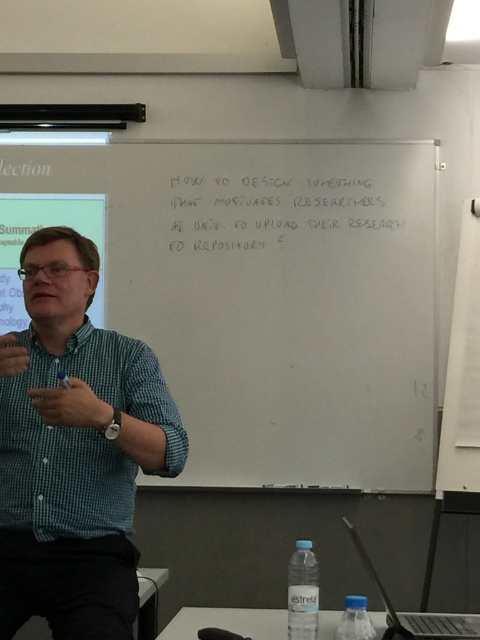
You are standing 6 feet away from the whiteboard in the classroom. You want to reach the green checkered shirt at left to hand the presenter a note. Can you do this without moving closer than 6 feet to the whiteboard?

The green checkered shirt at left is 5.99 feet away from the viewer, which is just under 6 feet. Therefore, you can reach the green checkered shirt at left without moving closer than 6 feet to the whiteboard.

You are a student in the classroom and want to take a photo of the whiteboard at upper center and the white handwritten text at upper center for your notes. Which one should you focus on first if you want to capture the entire content without cropping?

The whiteboard at upper center is taller than the white handwritten text at upper center, so you should focus on capturing the whiteboard at upper center first since it is larger and contains the entire area where the text is written.

You are a student in the classroom and want to know if the whiteboard at upper center is wider than the green checkered shirt at left. Can you confirm this?

The whiteboard at upper center is wider than the green checkered shirt at left according to the description.